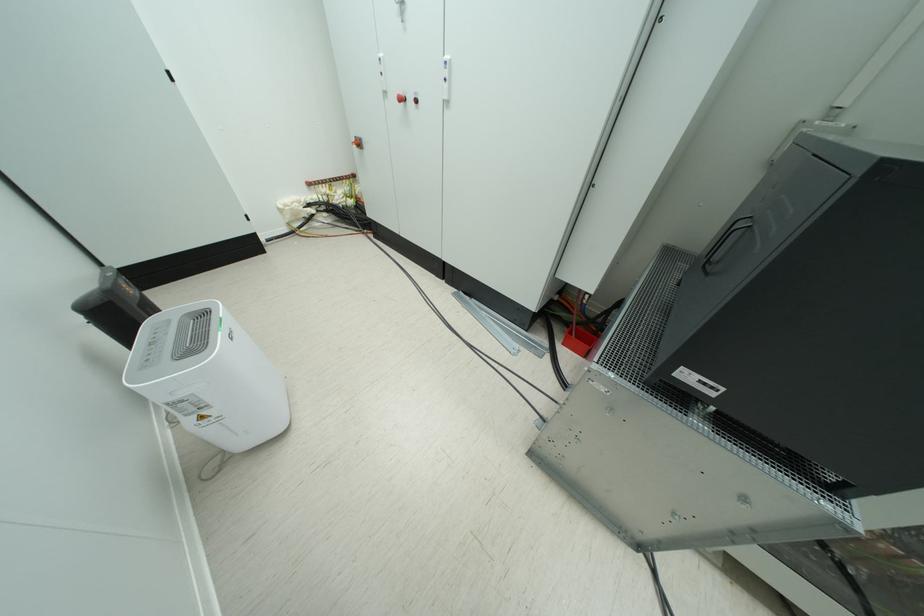
This screenshot has width=924, height=616. Find the location of `red rotary switch`. red rotary switch is located at coordinates (357, 142).